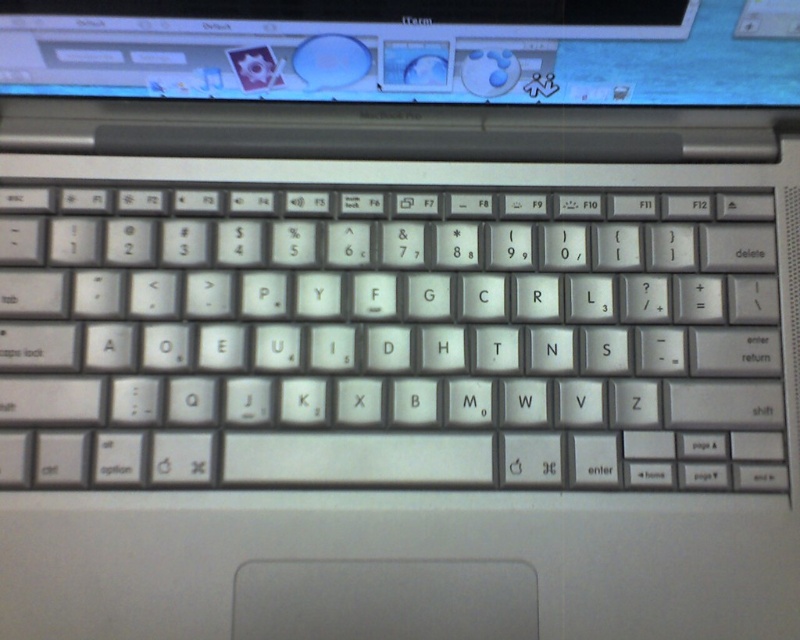
Is satin silver keyboard at center shorter than shiny plastic screen at upper center?

In fact, satin silver keyboard at center may be taller than shiny plastic screen at upper center.

Who is taller, satin silver keyboard at center or shiny plastic screen at upper center?

Standing taller between the two is satin silver keyboard at center.

Measure the distance between point (173,420) and camera.

They are 75.61 centimeters apart.

You are a GUI agent. You are given a task and a screenshot of the screen. Output one action in this format:
    pyautogui.click(x=<x>, y=<y>)
    Task: Click on the satin silver keyboard at center
    The width and height of the screenshot is (800, 640).
    Given the screenshot: What is the action you would take?
    pyautogui.click(x=388, y=339)